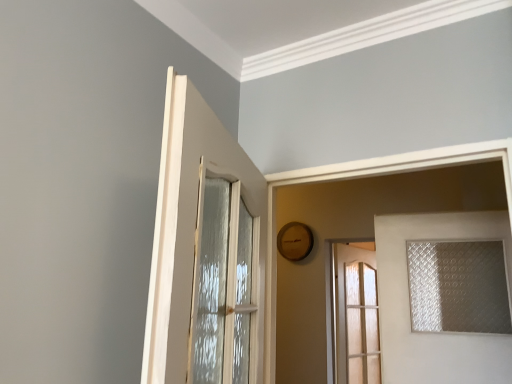
Image resolution: width=512 pixels, height=384 pixels. What do you see at coordinates (409, 308) in the screenshot? I see `clear glass door at right, the second door viewed from the back` at bounding box center [409, 308].

Find the location of a particular element. translucent frosted glass window at right is located at coordinates (458, 287).

Does white glossy door at upper left, which is counted as the first door, starting from the front, have a larger size compared to translucent glass door at center, the third door when ordered from front to back?

Yes, white glossy door at upper left, which is counted as the first door, starting from the front, is bigger than translucent glass door at center, the third door when ordered from front to back.

What's the angular difference between white glossy door at upper left, placed as the third door when sorted from back to front, and translucent glass door at center, which is counted as the first door, starting from the back,'s facing directions?

The angular difference between white glossy door at upper left, placed as the third door when sorted from back to front, and translucent glass door at center, which is counted as the first door, starting from the back, is 28.2 degrees.

From the image's perspective, which is below, white glossy door at upper left, which is the 3th door from right to left, or translucent glass door at center, the third door when ordered from front to back?

translucent glass door at center, the third door when ordered from front to back, appears lower in the image.

Considering the relative sizes of white glossy door at upper left, which is the 3th door from right to left, and translucent glass door at center, which appears as the second door when viewed from the left, in the image provided, is white glossy door at upper left, which is the 3th door from right to left, taller than translucent glass door at center, which appears as the second door when viewed from the left,?

In fact, white glossy door at upper left, which is the 3th door from right to left, may be shorter than translucent glass door at center, which appears as the second door when viewed from the left.

Is translucent glass door at center, which is counted as the first door, starting from the back, located within clear glass door at right, the third door in the left-to-right sequence?

No, translucent glass door at center, which is counted as the first door, starting from the back, is not a part of clear glass door at right, the third door in the left-to-right sequence.

Does clear glass door at right, the second door viewed from the back, lie in front of translucent glass door at center, the third door when ordered from front to back?

Yes, clear glass door at right, the second door viewed from the back, is closer to the viewer.

Is clear glass door at right, the 2th door in the front-to-back sequence, far from translucent glass door at center, acting as the second door starting from the right?

Yes, clear glass door at right, the 2th door in the front-to-back sequence, is far from translucent glass door at center, acting as the second door starting from the right.

From the image's perspective, does clear glass door at right, the third door in the left-to-right sequence, appear lower than translucent glass door at center, which appears as the second door when viewed from the left?

No, from the image's perspective, clear glass door at right, the third door in the left-to-right sequence, is not below translucent glass door at center, which appears as the second door when viewed from the left.

From the image's perspective, is translucent glass door at center, acting as the second door starting from the right, positioned above or below white glossy door at upper left, the first door when ordered from left to right?

A: translucent glass door at center, acting as the second door starting from the right, is situated lower than white glossy door at upper left, the first door when ordered from left to right, in the image.

Considering the positions of point (354, 321) and point (190, 382), is point (354, 321) closer or farther from the camera than point (190, 382)?

Point (354, 321) is farther from the camera than point (190, 382).

Choose the correct answer: Is translucent glass door at center, acting as the second door starting from the right, inside white glossy door at upper left, which is the 3th door from right to left, or outside it?

translucent glass door at center, acting as the second door starting from the right, exists outside the volume of white glossy door at upper left, which is the 3th door from right to left.

Is translucent glass door at center, which appears as the second door when viewed from the left, facing away from white glossy door at upper left, which is counted as the first door, starting from the front?

No.

From the clear glass door at right, the third door in the left-to-right sequence, count the 2nd door to the left and point to it. Please provide its 2D coordinates.

[(205, 251)]

Is clear glass door at right, the third door in the left-to-right sequence, to the left or to the right of white glossy door at upper left, which is the 3th door from right to left, in the image?

From the image, it's evident that clear glass door at right, the third door in the left-to-right sequence, is to the right of white glossy door at upper left, which is the 3th door from right to left.

From their relative heights in the image, would you say clear glass door at right, the third door in the left-to-right sequence, is taller or shorter than white glossy door at upper left, which is the 3th door from right to left?

Considering their sizes, clear glass door at right, the third door in the left-to-right sequence, has more height than white glossy door at upper left, which is the 3th door from right to left.

Considering the relative positions of translucent glass door at center, acting as the second door starting from the right, and clear glass door at right, the 1th door from the right, in the image provided, is translucent glass door at center, acting as the second door starting from the right, in front of clear glass door at right, the 1th door from the right,?

No, translucent glass door at center, acting as the second door starting from the right, is behind clear glass door at right, the 1th door from the right.

Is translucent glass door at center, acting as the second door starting from the right, facing towards clear glass door at right, the third door in the left-to-right sequence?

No.

Is clear glass door at right, the 2th door in the front-to-back sequence, completely or partially inside translucent glass door at center, which is counted as the first door, starting from the back?

No, clear glass door at right, the 2th door in the front-to-back sequence, is not a part of translucent glass door at center, which is counted as the first door, starting from the back.

Relative to translucent glass door at center, the third door when ordered from front to back, is translucent frosted glass window at right in front or behind?

translucent frosted glass window at right is in front of translucent glass door at center, the third door when ordered from front to back.

Considering the positions of points (479, 308) and (350, 268), is point (479, 308) farther from camera compared to point (350, 268)?

That is False.

What's the angular difference between translucent frosted glass window at right and translucent glass door at center, which is counted as the first door, starting from the back,'s facing directions?

70.3 degrees separate the facing orientations of translucent frosted glass window at right and translucent glass door at center, which is counted as the first door, starting from the back.

Is the surface of translucent frosted glass window at right in direct contact with translucent glass door at center, which is counted as the first door, starting from the back?

They are not placed beside each other.

Which is more to the right, white glossy door at upper left, which is the 3th door from right to left, or translucent frosted glass window at right?

translucent frosted glass window at right.

Who is smaller, white glossy door at upper left, which is counted as the first door, starting from the front, or translucent frosted glass window at right?

With smaller size is translucent frosted glass window at right.

Is white glossy door at upper left, which is the 3th door from right to left, oriented away from translucent frosted glass window at right?

That's not correct — white glossy door at upper left, which is the 3th door from right to left, is not looking away from translucent frosted glass window at right.

From their relative heights in the image, would you say white glossy door at upper left, placed as the third door when sorted from back to front, is taller or shorter than translucent frosted glass window at right?

Considering their sizes, white glossy door at upper left, placed as the third door when sorted from back to front, has more height than translucent frosted glass window at right.

You are a GUI agent. You are given a task and a screenshot of the screen. Output one action in this format:
    pyautogui.click(x=<x>, y=<y>)
    Task: Click on the door that is the 2nd object located below the white glossy door at upper left, placed as the third door when sorted from back to front (from the image's perspective)
    
    Given the screenshot: What is the action you would take?
    pyautogui.click(x=357, y=316)

Image resolution: width=512 pixels, height=384 pixels. I want to click on door behind the clear glass door at right, the 2th door in the front-to-back sequence, so click(357, 316).

Which object lies further to the anchor point white glossy door at upper left, placed as the third door when sorted from back to front, clear glass door at right, the second door viewed from the back, or translucent frosted glass window at right?

translucent frosted glass window at right is further to white glossy door at upper left, placed as the third door when sorted from back to front.

Which object lies further to the anchor point clear glass door at right, the 1th door from the right, translucent frosted glass window at right or translucent glass door at center, which appears as the second door when viewed from the left?

The object further to clear glass door at right, the 1th door from the right, is translucent glass door at center, which appears as the second door when viewed from the left.

When comparing their distances from translucent frosted glass window at right, does clear glass door at right, the 2th door in the front-to-back sequence, or translucent glass door at center, acting as the second door starting from the right, seem closer?

clear glass door at right, the 2th door in the front-to-back sequence, is positioned closer to the anchor translucent frosted glass window at right.

When comparing their distances from translucent glass door at center, which is counted as the first door, starting from the back, does translucent frosted glass window at right or clear glass door at right, the 2th door in the front-to-back sequence, seem closer?

clear glass door at right, the 2th door in the front-to-back sequence, lies closer to translucent glass door at center, which is counted as the first door, starting from the back, than the other object.

Considering their positions, is translucent glass door at center, which is counted as the first door, starting from the back, positioned closer to clear glass door at right, the third door in the left-to-right sequence, than white glossy door at upper left, which is counted as the first door, starting from the front?

white glossy door at upper left, which is counted as the first door, starting from the front, is closer to clear glass door at right, the third door in the left-to-right sequence.

Estimate the real-world distances between objects in this image. Which object is closer to white glossy door at upper left, which is the 3th door from right to left, translucent glass door at center, which is counted as the first door, starting from the back, or translucent frosted glass window at right?

translucent frosted glass window at right.

When comparing their distances from translucent glass door at center, which is counted as the first door, starting from the back, does white glossy door at upper left, which is counted as the first door, starting from the front, or clear glass door at right, the third door in the left-to-right sequence, seem further?

white glossy door at upper left, which is counted as the first door, starting from the front, is further to translucent glass door at center, which is counted as the first door, starting from the back.

Looking at the image, which one is located closer to translucent frosted glass window at right, translucent glass door at center, which is counted as the first door, starting from the back, or white glossy door at upper left, the first door when ordered from left to right?

The object closer to translucent frosted glass window at right is white glossy door at upper left, the first door when ordered from left to right.

Locate an element on the screen. Image resolution: width=512 pixels, height=384 pixels. door between white glossy door at upper left, the first door when ordered from left to right, and translucent frosted glass window at right from front to back is located at coordinates (409, 308).

Identify the location of door located between white glossy door at upper left, which is counted as the first door, starting from the front, and translucent glass door at center, acting as the second door starting from the right, in the depth direction. The image size is (512, 384). (409, 308).

Locate an element on the screen. window between white glossy door at upper left, the first door when ordered from left to right, and translucent glass door at center, which is counted as the first door, starting from the back, in the front-back direction is located at coordinates (458, 287).

Where is `window between clear glass door at right, the third door in the left-to-right sequence, and translucent glass door at center, which is counted as the first door, starting from the back, from front to back`? window between clear glass door at right, the third door in the left-to-right sequence, and translucent glass door at center, which is counted as the first door, starting from the back, from front to back is located at coordinates (458, 287).